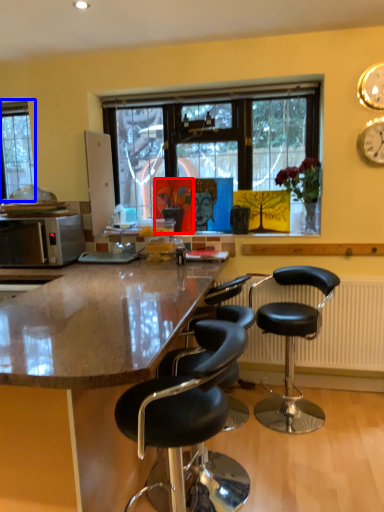
Question: Which object is closer to the camera taking this photo, person (highlighted by a red box) or window (highlighted by a blue box)?

Choices:
 (A) person
 (B) window

Answer: (A)